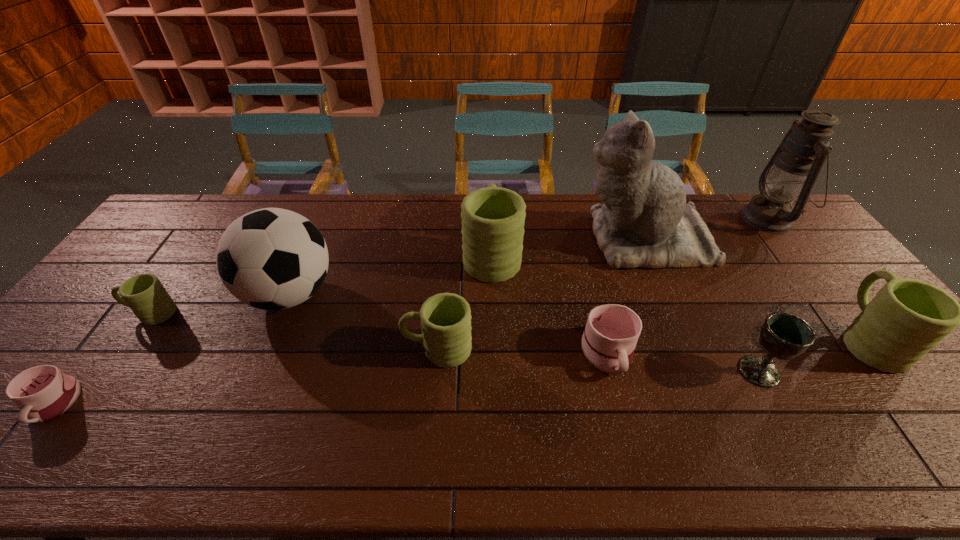
Where is `empty space that is in between the second smallest green mug and the smallest green mug`? empty space that is in between the second smallest green mug and the smallest green mug is located at coordinates pyautogui.click(x=295, y=331).

Choose which object is the ninth nearest neighbor to the eighth object from right to left. Please provide its 2D coordinates. Your answer should be formatted as a tuple, i.e. [(x, y)], where the tuple contains the x and y coordinates of a point satisfying the conditions above.

[(907, 318)]

The width and height of the screenshot is (960, 540). What are the coordinates of `object that stands as the third closest to the leftmost green mug` in the screenshot? It's located at 445,318.

The height and width of the screenshot is (540, 960). Find the location of `mug that is the third closest to the right white mug`. mug that is the third closest to the right white mug is located at coordinates (907, 318).

Identify the location of mug that is the fifth closest one to the third object from left to right. (608, 343).

At what (x,y) coordinates should I click in order to perform the action: click on green mug identified as the fourth closest to the cat. Please return your answer as a coordinate pair (x, y). Looking at the image, I should click on (144, 294).

The width and height of the screenshot is (960, 540). Identify the location of the third closest green mug to the leftmost green mug. (907, 318).

Locate an element on the screen. vacant space that satisfies the following two spatial constraints: 1. on the side of the leftmost green mug with the handle; 2. on the side with the handle of the shortest mug is located at coordinates (86, 404).

I want to click on vacant region that satisfies the following two spatial constraints: 1. on the side of the leftmost green mug with the handle; 2. on the side of the rightmost mug with the handle, so click(x=133, y=339).